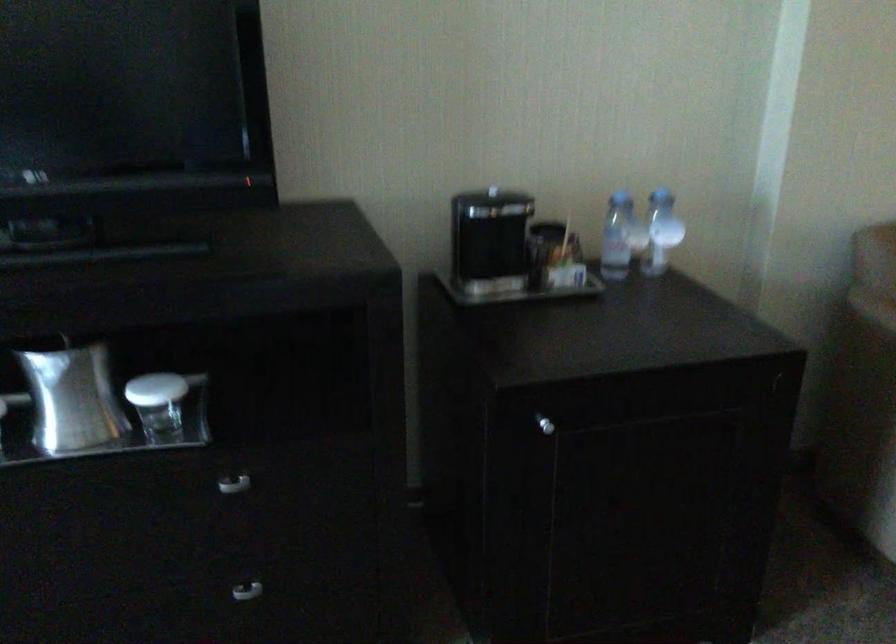
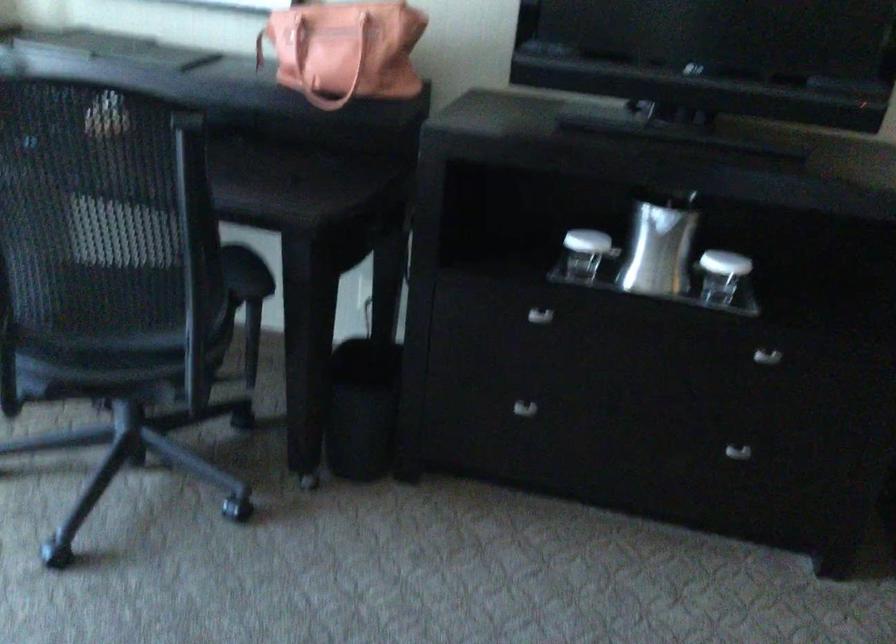
Question: The images are taken continuously from a first-person perspective. In which direction is your viewpoint rotating?

Choices:
 (A) Left
 (B) Right
 (C) Up
 (D) Down

Answer: (A)